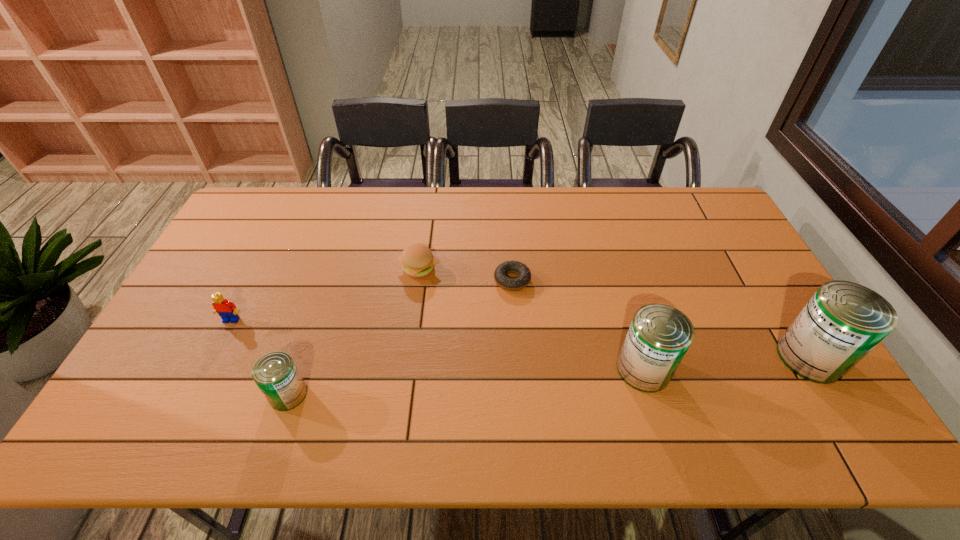
The width and height of the screenshot is (960, 540). I want to click on free space for an extra can to achieve even spacing, so click(469, 381).